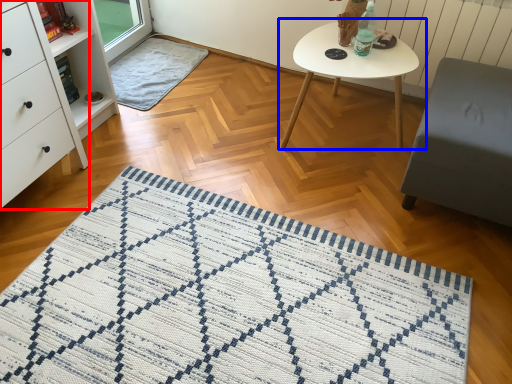
Question: Which of the following is the farthest to the observer, chest of drawers (highlighted by a red box) or coffee table (highlighted by a blue box)?

Choices:
 (A) chest of drawers
 (B) coffee table

Answer: (B)